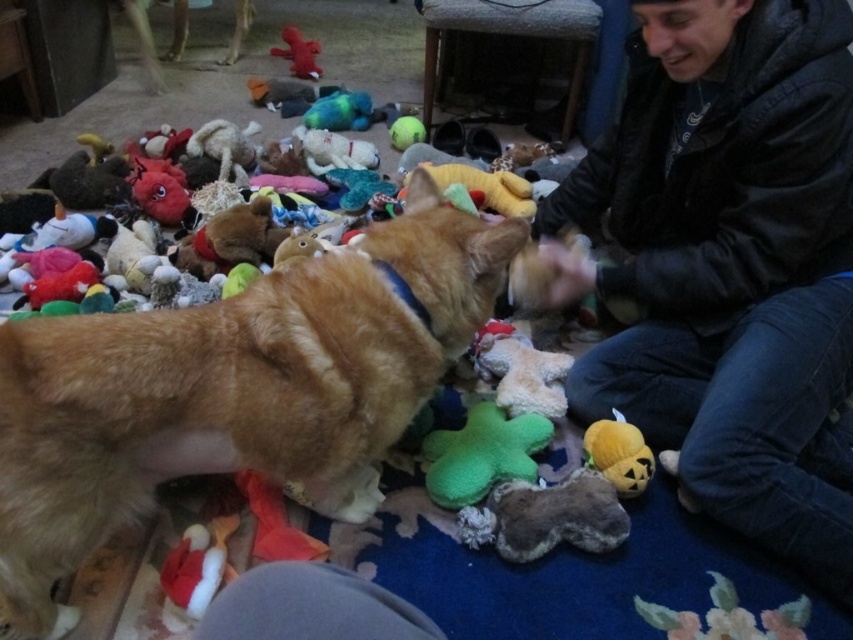
Does brown plush dog at center have a greater height compared to green fuzzy star at center?

Yes.

Between point (62, 512) and point (431, 444), which one is positioned behind?

The point (431, 444) is more distant.

Between point (218, 410) and point (450, 451), which one is positioned behind?

The point (450, 451) is behind.

Where is `brown plush dog at center`? The image size is (853, 640). brown plush dog at center is located at coordinates (233, 388).

Is black leather jacket at upper right bigger than green fuzzy star at center?

Yes.

Is point (682, 369) more distant than point (518, 444)?

Yes.

Does point (616, 356) lie behind point (532, 449)?

That is True.

The height and width of the screenshot is (640, 853). What are the coordinates of `black leather jacket at upper right` in the screenshot? It's located at (728, 260).

The height and width of the screenshot is (640, 853). Find the location of `brown plush dog at center`. brown plush dog at center is located at coordinates (233, 388).

Is point (93, 376) farther from camera compared to point (637, 483)?

No.

Locate an element on the screen. This screenshot has height=640, width=853. brown plush dog at center is located at coordinates (233, 388).